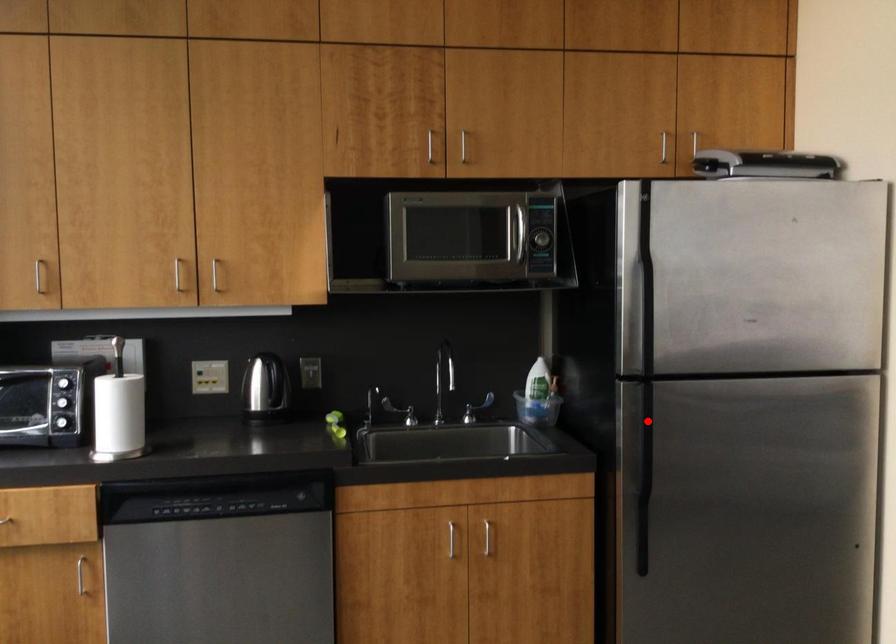
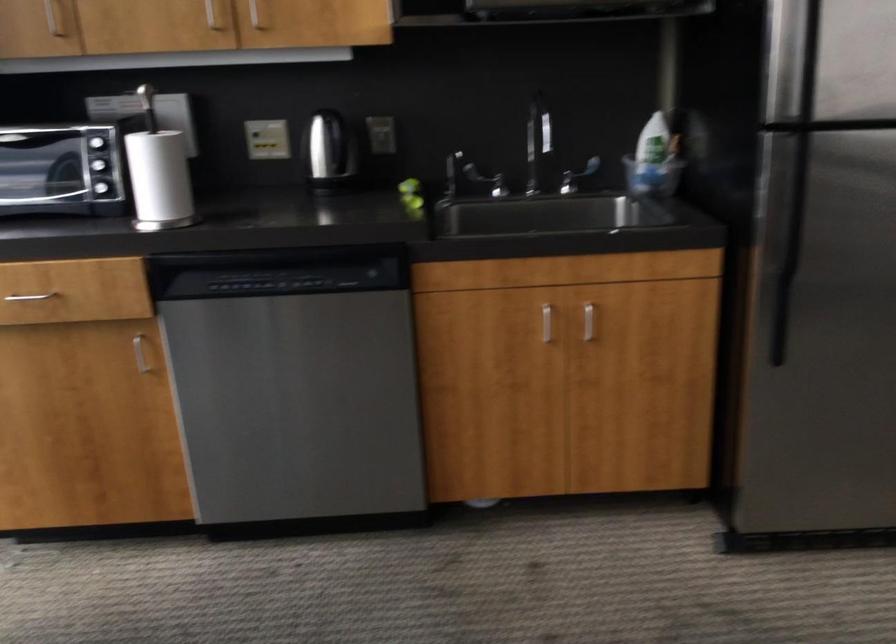
Question: I am providing you with two images of the same scene from different viewpoints. In image1, a red point is highlighted. Considering the same 3D point in image2, which of the following is correct?

Choices:
 (A) It is closer
 (B) It is farther

Answer: (A)